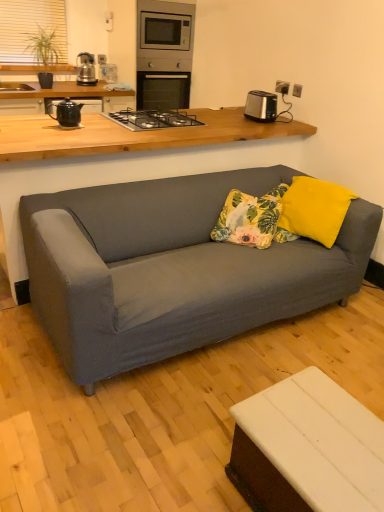
In the scene shown: What is the approximate height of yellow fabric pillow at center?

yellow fabric pillow at center is 13.15 inches tall.

What do you see at coordinates (314, 209) in the screenshot? I see `yellow fabric pillow at center` at bounding box center [314, 209].

Describe the element at coordinates (122, 140) in the screenshot. I see `matte gray couch at center, the first table positioned from the top` at that location.

Find the location of `black ceramic teapot at left`. black ceramic teapot at left is located at coordinates tap(66, 113).

Describe the element at coordinates (66, 113) in the screenshot. I see `black ceramic teapot at left` at that location.

Describe the element at coordinates (261, 106) in the screenshot. I see `satin silver toaster at upper right` at that location.

Image resolution: width=384 pixels, height=512 pixels. I want to click on floral fabric pillow at center, so click(252, 219).

Locate an element on the screen. The height and width of the screenshot is (512, 384). yellow fabric pillow at center is located at coordinates (314, 209).

Which point is more forward, (270, 113) or (370, 445)?

Point (370, 445)

Does satin silver toaster at upper right have a lesser width compared to white matte table at lower right, the 1th table when ordered from bottom to top?

Yes, satin silver toaster at upper right is thinner than white matte table at lower right, the 1th table when ordered from bottom to top.

From a real-world perspective, between satin silver toaster at upper right and white matte table at lower right, the 1th table when ordered from bottom to top, who is vertically higher?

satin silver toaster at upper right, from a real-world perspective.

Are satin silver toaster at upper right and white matte table at lower right, the 1th table when ordered from bottom to top, far apart?

Yes.

Find the location of `gas stove above the floral fabric pillow at center (from a real-world perspective)`. gas stove above the floral fabric pillow at center (from a real-world perspective) is located at coordinates (152, 119).

Is floral fabric pillow at center positioned beyond the bounds of black metal gas stove at upper center?

Yes.

Which of these two, floral fabric pillow at center or black metal gas stove at upper center, is thinner?

With smaller width is floral fabric pillow at center.

Is floral fabric pillow at center placed right next to yellow fabric pillow at center?

They are not placed beside each other.

Which of these two, floral fabric pillow at center or yellow fabric pillow at center, is thinner?

yellow fabric pillow at center is thinner.

Which object is more forward, floral fabric pillow at center or yellow fabric pillow at center?

yellow fabric pillow at center.

Does floral fabric pillow at center have a lesser height compared to yellow fabric pillow at center?

Yes.

Considering the positions of objects white matte table at lower right, which is the second table from top to bottom, and yellow fabric pillow at center in the image provided, who is in front, white matte table at lower right, which is the second table from top to bottom, or yellow fabric pillow at center?

white matte table at lower right, which is the second table from top to bottom, is closer to the camera.

Considering the relative sizes of white matte table at lower right, which ranks as the second table in back-to-front order, and yellow fabric pillow at center in the image provided, is white matte table at lower right, which ranks as the second table in back-to-front order, smaller than yellow fabric pillow at center?

No.

Between white matte table at lower right, the 1th table positioned from the front, and yellow fabric pillow at center, which one appears on the right side from the viewer's perspective?

Positioned to the right is yellow fabric pillow at center.

Which is less distant, (179, 122) or (29, 58)?

Clearly, point (179, 122) is closer to the camera than point (29, 58).

How many degrees apart are the facing directions of black metal gas stove at upper center and beige fabric window screen at upper left?

The angular difference between black metal gas stove at upper center and beige fabric window screen at upper left is 180 degrees.

Which object is positioned more to the right, black metal gas stove at upper center or beige fabric window screen at upper left?

Positioned to the right is black metal gas stove at upper center.

Is black metal gas stove at upper center taller or shorter than beige fabric window screen at upper left?

black metal gas stove at upper center is shorter than beige fabric window screen at upper left.

Can you tell me how much stainless steel oven at upper center and black metal gas stove at upper center differ in facing direction?

The facing directions of stainless steel oven at upper center and black metal gas stove at upper center are 180 degrees apart.

Can you confirm if stainless steel oven at upper center is bigger than black metal gas stove at upper center?

Correct, stainless steel oven at upper center is larger in size than black metal gas stove at upper center.

Is point (143, 94) positioned in front of point (108, 115)?

No, (143, 94) is further to viewer.

Between stainless steel oven at upper center and black metal gas stove at upper center, which one has more height?

With more height is stainless steel oven at upper center.

Which object is more forward, matte gray couch at center, the first table positioned from the top, or yellow fabric pillow at center?

matte gray couch at center, the first table positioned from the top, is closer to the camera.

Is yellow fabric pillow at center located within matte gray couch at center, which is the second table in front-to-back order?

No, yellow fabric pillow at center is not inside matte gray couch at center, which is the second table in front-to-back order.

How different are the orientations of matte gray couch at center, the first table positioned from the top, and yellow fabric pillow at center in degrees?

They differ by 111 degrees in their facing directions.

Is matte gray couch at center, the first table positioned from the top, bigger or smaller than yellow fabric pillow at center?

matte gray couch at center, the first table positioned from the top, is bigger than yellow fabric pillow at center.

Image resolution: width=384 pixels, height=512 pixels. What are the coordinates of `table that is the 2nd object located below the satin silver toaster at upper right (from the image's perspective)` in the screenshot? It's located at (309, 447).

Where is `gas stove that is above the floral fabric pillow at center (from a real-world perspective)`? Image resolution: width=384 pixels, height=512 pixels. gas stove that is above the floral fabric pillow at center (from a real-world perspective) is located at coordinates (152, 119).

Estimate the real-world distances between objects in this image. Which object is closer to white matte table at lower right, which is the second table from top to bottom, floral fabric pillow at center or stainless steel oven at upper center?

floral fabric pillow at center.

Looking at the image, which one is located closer to satin silver toaster at upper right, stainless steel oven at upper center or matte gray couch at center, the first table positioned from the top?

matte gray couch at center, the first table positioned from the top.

When comparing their distances from white matte table at lower right, the 1th table when ordered from bottom to top, does floral fabric pillow at center or satin silver toaster at upper right seem further?

satin silver toaster at upper right lies further to white matte table at lower right, the 1th table when ordered from bottom to top, than the other object.

When comparing their distances from yellow fabric pillow at center, does beige fabric window screen at upper left or matte gray couch at center, which is the second table in front-to-back order, seem further?

beige fabric window screen at upper left is further to yellow fabric pillow at center.

When comparing their distances from black ceramic teapot at left, does yellow fabric pillow at center or stainless steel oven at upper center seem further?

The object further to black ceramic teapot at left is stainless steel oven at upper center.

Considering their positions, is floral fabric pillow at center positioned closer to beige fabric window screen at upper left than black metal gas stove at upper center?

black metal gas stove at upper center is positioned closer to the anchor beige fabric window screen at upper left.

From the image, which object appears to be farther from yellow fabric pillow at center, black metal gas stove at upper center or floral fabric pillow at center?

The object further to yellow fabric pillow at center is black metal gas stove at upper center.

From the image, which object appears to be nearer to white matte table at lower right, the 1th table positioned from the front, black metal gas stove at upper center or beige fabric window screen at upper left?

black metal gas stove at upper center lies closer to white matte table at lower right, the 1th table positioned from the front, than the other object.

Image resolution: width=384 pixels, height=512 pixels. I want to click on pillow between white matte table at lower right, the 1th table when ordered from bottom to top, and satin silver toaster at upper right from front to back, so click(314, 209).

You are a GUI agent. You are given a task and a screenshot of the screen. Output one action in this format:
    pyautogui.click(x=<x>, y=<y>)
    Task: Click on the throw pillow located between beige fabric window screen at upper left and satin silver toaster at upper right in the left-right direction
    
    Given the screenshot: What is the action you would take?
    pyautogui.click(x=252, y=219)

At what (x,y) coordinates should I click in order to perform the action: click on gas stove between matte gray couch at center, which appears as the second table when ordered from the bottom, and satin silver toaster at upper right, along the z-axis. Please return your answer as a coordinate pair (x, y). Looking at the image, I should click on (152, 119).

Identify the location of gas stove between stainless steel oven at upper center and floral fabric pillow at center from top to bottom. This screenshot has height=512, width=384. (152, 119).